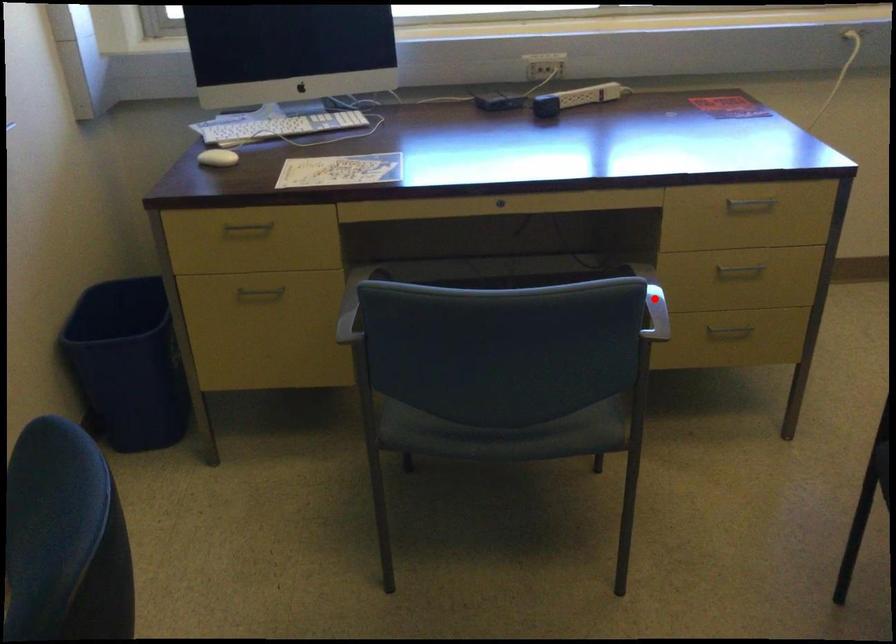
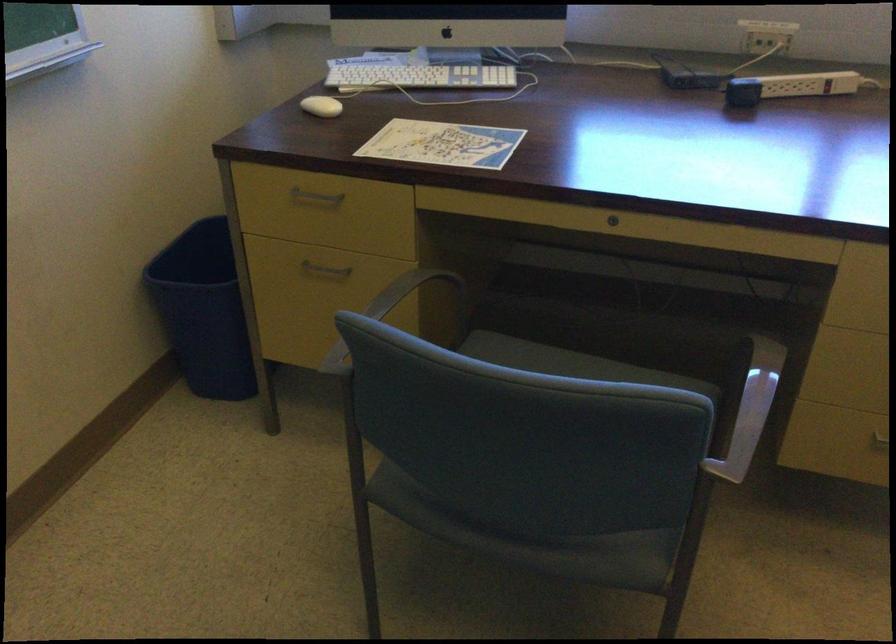
Question: I am providing you with two images of the same scene from different viewpoints. Image1 has a red point marked. In image2, the corresponding 3D location appears at what relative position? Reply with the corresponding letter.

Choices:
 (A) Closer
 (B) Farther

Answer: (A)